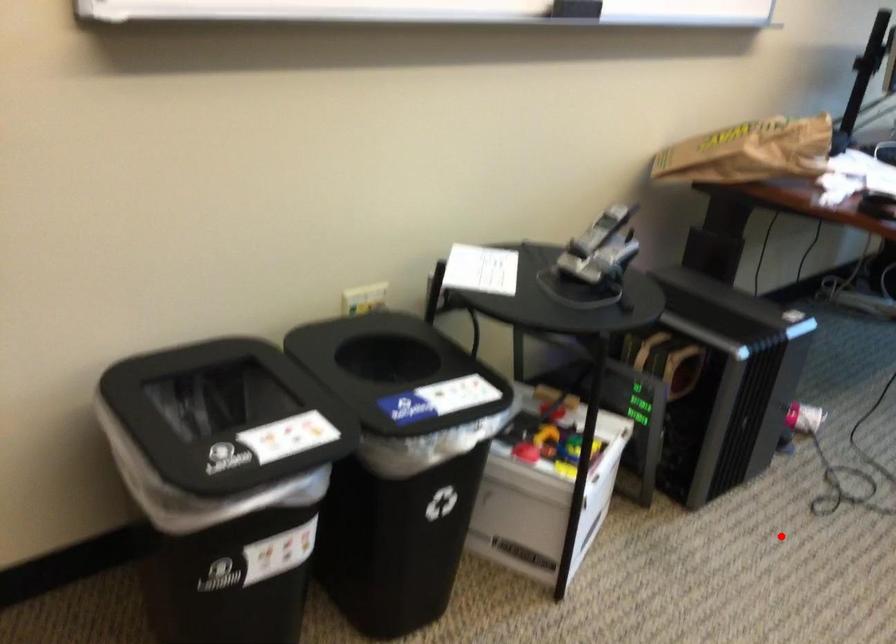
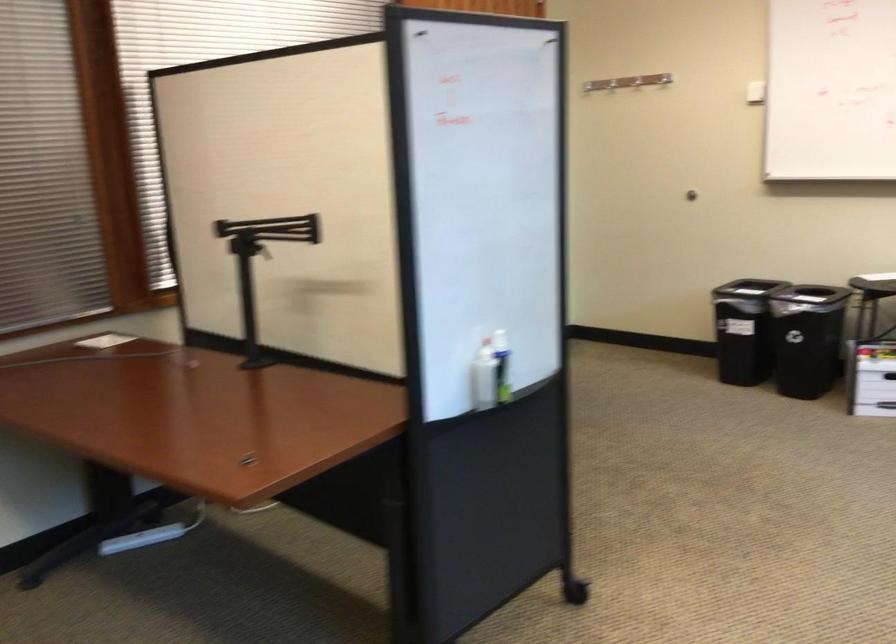
Question: I am providing you with two images of the same scene from different viewpoints. A red point is marked on the first image. Can you still see the location of the red point in image 2?

Choices:
 (A) Yes
 (B) No

Answer: (A)